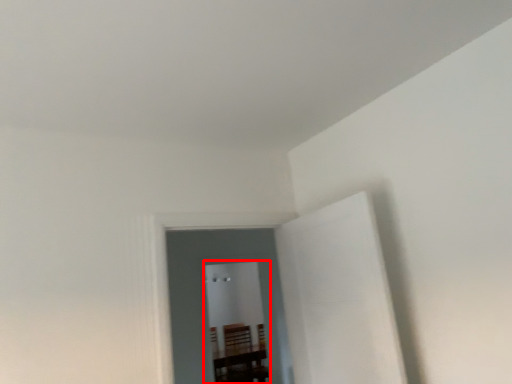
Question: Where is glass door (annotated by the red box) located in relation to glass door in the image?

Choices:
 (A) left
 (B) right

Answer: (A)